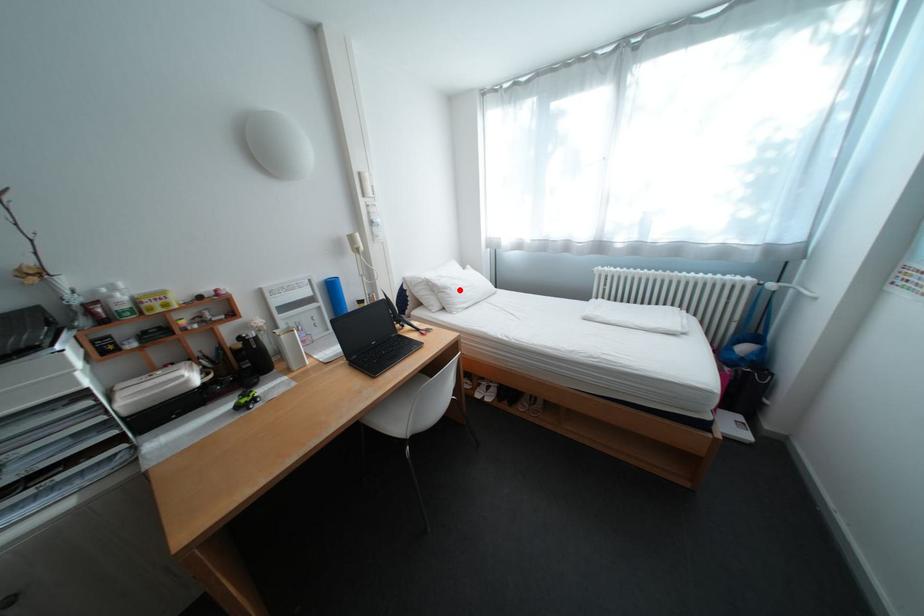
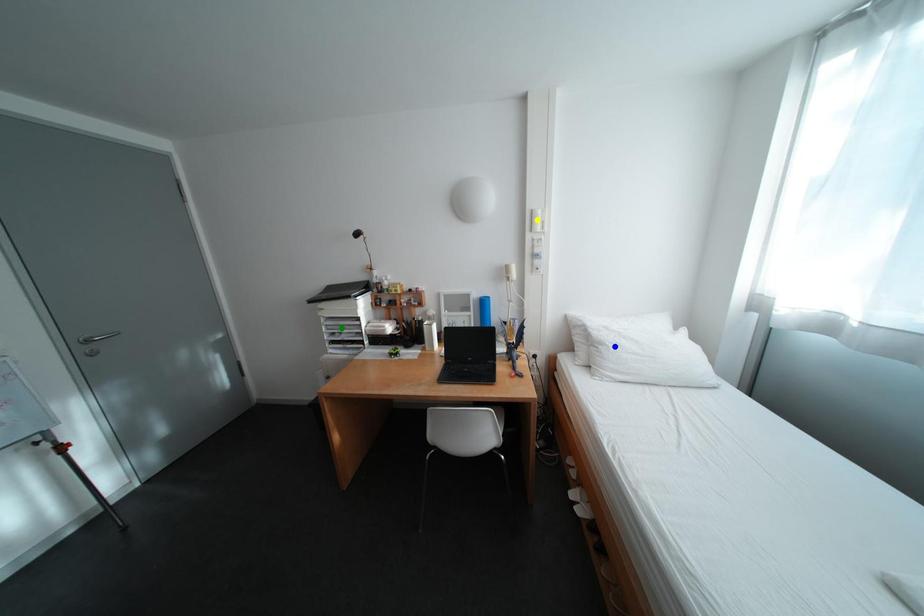
Question: I am providing you with two images of the same scene from different viewpoints. A red point is marked on the first image. You are given multiple points on the second image. Which spot in image 2 lines up with the point in image 1?

Choices:
 (A) blue point
 (B) green point
 (C) yellow point

Answer: (A)